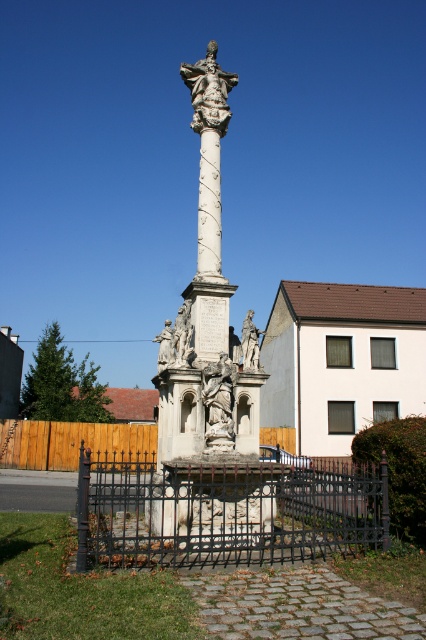
Question: Which point is farther to the camera?

Choices:
 (A) white stone statue at center
 (B) wooden fence at lower left
 (C) black wrought iron fence at center

Answer: (B)

Question: Estimate the real-world distances between objects in this image. Which object is closer to the white stone column at center?

Choices:
 (A) wooden fence at lower left
 (B) white stone statue at center

Answer: (B)

Question: Which point is farther from the camera taking this photo?

Choices:
 (A) (224, 451)
 (B) (5, 445)
 (C) (255, 360)
 (D) (196, 541)

Answer: (B)

Question: Does wooden fence at lower left have a larger size compared to white stone statue at center?

Choices:
 (A) no
 (B) yes

Answer: (B)

Question: Is white stone column at center smaller than white stone statue at center?

Choices:
 (A) no
 (B) yes

Answer: (A)

Question: Is black wrought iron fence at center thinner than white stone statue at center?

Choices:
 (A) no
 (B) yes

Answer: (A)